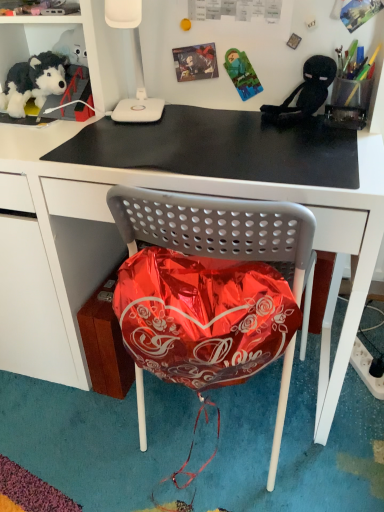
Describe the element at coordinates (220, 148) in the screenshot. Image resolution: width=384 pixels, height=512 pixels. I see `black matte mousepad at upper center` at that location.

What is the approximate width of black matte mousepad at upper center?

black matte mousepad at upper center is 18.56 inches in width.

The height and width of the screenshot is (512, 384). Describe the element at coordinates (366, 369) in the screenshot. I see `white plastic power outlet at lower right` at that location.

I want to click on black plush toy at upper right, so click(x=304, y=93).

From a real-world perspective, is white plastic lamp at upper center physically located above or below black plush toy at upper right?

From a real-world perspective, white plastic lamp at upper center is physically above black plush toy at upper right.

Do you think white plastic lamp at upper center is within black plush toy at upper right, or outside of it?

white plastic lamp at upper center lies outside black plush toy at upper right.

Is white plastic lamp at upper center facing away from black plush toy at upper right?

No.

Considering the relative sizes of black matte desk at center and black matte mousepad at upper center in the image provided, is black matte desk at center taller than black matte mousepad at upper center?

Indeed, black matte desk at center has a greater height compared to black matte mousepad at upper center.

Identify the location of desk on the left of the black matte mousepad at upper center. This screenshot has height=512, width=384. (177, 191).

From a real-world perspective, is black matte desk at center physically located above or below black matte mousepad at upper center?

black matte desk at center is situated lower than black matte mousepad at upper center in the real world.

Can you tell me how much black matte desk at center and black matte mousepad at upper center differ in facing direction?

0.578 degrees separate the facing orientations of black matte desk at center and black matte mousepad at upper center.

Between point (6, 89) and point (171, 143), which one is positioned behind?

Positioned behind is point (6, 89).

Considering the sizes of objects soft plush toy at upper left and black matte mousepad at upper center in the image provided, who is thinner, soft plush toy at upper left or black matte mousepad at upper center?

soft plush toy at upper left is thinner.

Is soft plush toy at upper left facing away from black matte mousepad at upper center?

No, soft plush toy at upper left's orientation is not away from black matte mousepad at upper center.

Which is behind, soft plush toy at upper left or black plush toy at upper right?

soft plush toy at upper left.

Which is in front, point (39, 100) or point (293, 106)?

The point (293, 106) is closer to the camera.

Would you say soft plush toy at upper left is inside or outside black plush toy at upper right?

The correct answer is: outside.

In the image, there is a black plush toy at upper right. At what (x,y) coordinates should I click in order to perform the action: click on chair below it (from a real-world perspective). Please return your answer as a coordinate pair (x, y). Looking at the image, I should click on (216, 226).

Which of these two, black plush toy at upper right or metallic red balloon at center, is thinner?

black plush toy at upper right is thinner.

Is black plush toy at upper right with metallic red balloon at center?

No, black plush toy at upper right is not making contact with metallic red balloon at center.

Which of these two, black plush toy at upper right or metallic red balloon at center, is bigger?

Bigger between the two is metallic red balloon at center.

Is white plastic lamp at upper center positioned beyond the bounds of white plastic power outlet at lower right?

Yes, white plastic lamp at upper center is located beyond the bounds of white plastic power outlet at lower right.

Is white plastic lamp at upper center wider or thinner than white plastic power outlet at lower right?

white plastic lamp at upper center is thinner than white plastic power outlet at lower right.

Is there a large distance between white plastic lamp at upper center and white plastic power outlet at lower right?

No, there isn't a large distance between white plastic lamp at upper center and white plastic power outlet at lower right.

Is white plastic lamp at upper center shorter than white plastic power outlet at lower right?

No, white plastic lamp at upper center is not shorter than white plastic power outlet at lower right.

What's the angular difference between black matte mousepad at upper center and white plastic lamp at upper center's facing directions?

13.3 degrees.

Between black matte mousepad at upper center and white plastic lamp at upper center, which one has smaller width?

white plastic lamp at upper center is thinner.

Measure the distance between black matte mousepad at upper center and white plastic lamp at upper center.

black matte mousepad at upper center is 23.09 centimeters from white plastic lamp at upper center.

From a real-world perspective, is black matte mousepad at upper center positioned above or below white plastic lamp at upper center?

black matte mousepad at upper center is situated lower than white plastic lamp at upper center in the real world.

Where is `person behind the white plastic lamp at upper center`? Image resolution: width=384 pixels, height=512 pixels. person behind the white plastic lamp at upper center is located at coordinates (304, 93).

You are a GUI agent. You are given a task and a screenshot of the screen. Output one action in this format:
    pyautogui.click(x=<x>, y=<y>)
    Task: Click on the desk in front of the black matte mousepad at upper center
    The height and width of the screenshot is (512, 384).
    Given the screenshot: What is the action you would take?
    pyautogui.click(x=177, y=191)

Which object lies further to the anchor point black matte mousepad at upper center, white plastic lamp at upper center or metallic red balloon at center?

metallic red balloon at center is positioned further to the anchor black matte mousepad at upper center.

Considering their positions, is white plastic lamp at upper center positioned closer to black matte mousepad at upper center than white plastic power outlet at lower right?

white plastic lamp at upper center.

Which object lies further to the anchor point white plastic lamp at upper center, black matte mousepad at upper center or black matte desk at center?

black matte desk at center is further to white plastic lamp at upper center.

Considering their positions, is black plush toy at upper right positioned closer to black matte desk at center than white plastic power outlet at lower right?

black plush toy at upper right lies closer to black matte desk at center than the other object.

From the image, which object appears to be farther from black matte mousepad at upper center, white plastic lamp at upper center or black matte desk at center?

white plastic lamp at upper center lies further to black matte mousepad at upper center than the other object.

Which object lies nearer to the anchor point black matte desk at center, metallic red balloon at center or white plastic lamp at upper center?

metallic red balloon at center is positioned closer to the anchor black matte desk at center.

Which object lies further to the anchor point white plastic power outlet at lower right, soft plush toy at upper left or white plastic lamp at upper center?

soft plush toy at upper left is further to white plastic power outlet at lower right.

Considering their positions, is black plush toy at upper right positioned closer to metallic red balloon at center than soft plush toy at upper left?

black plush toy at upper right.

You are a GUI agent. You are given a task and a screenshot of the screen. Output one action in this format:
    pyautogui.click(x=<x>, y=<y>)
    Task: Click on the desk between soft plush toy at upper left and black plush toy at upper right from left to right
    The width and height of the screenshot is (384, 512).
    Given the screenshot: What is the action you would take?
    pyautogui.click(x=177, y=191)

The width and height of the screenshot is (384, 512). I want to click on table top positioned between black matte desk at center and black plush toy at upper right from near to far, so click(x=220, y=148).

Find the location of a particular element. Image resolution: width=384 pixels, height=512 pixels. lamp positioned between black matte desk at center and soft plush toy at upper left from near to far is located at coordinates (134, 64).

The height and width of the screenshot is (512, 384). What are the coordinates of `lamp situated between soft plush toy at upper left and white plastic power outlet at lower right from left to right` in the screenshot? It's located at (134, 64).